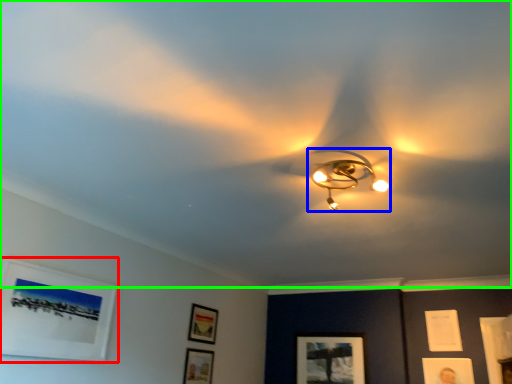
Question: Considering the real-world distances, which object is closest to picture frame (highlighted by a red box)? lamp (highlighted by a blue box) or fan (highlighted by a green box).

Choices:
 (A) lamp
 (B) fan

Answer: (B)